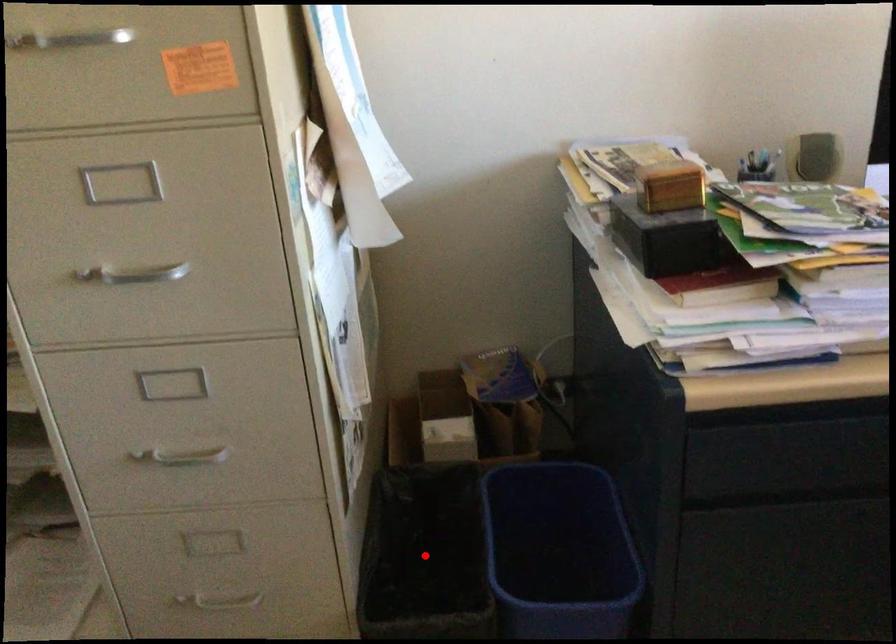
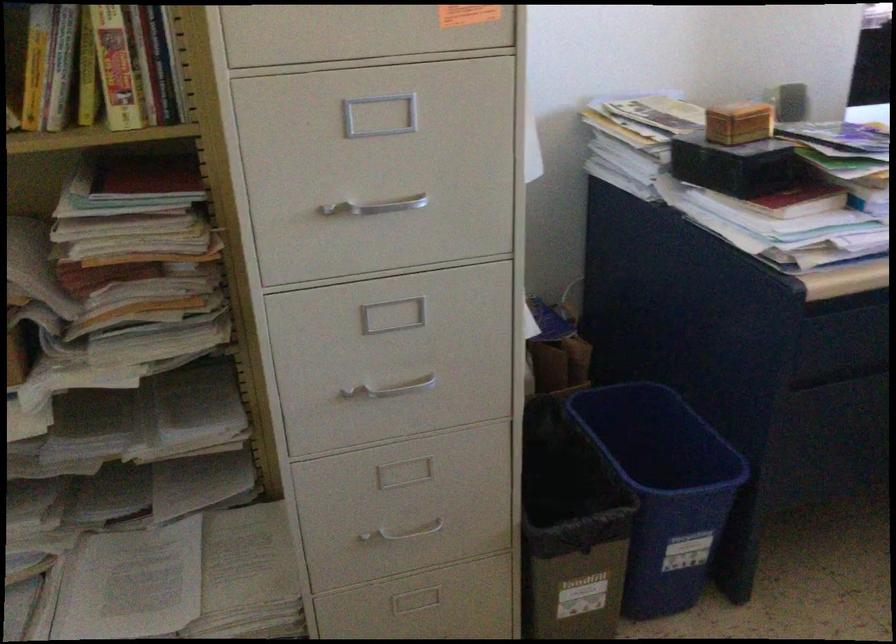
Question: I am providing you with two images of the same scene from different viewpoints. A red point is marked on the first image. At the location where the point appears in image 1, is it still visible in image 2?

Choices:
 (A) Yes
 (B) No

Answer: (B)